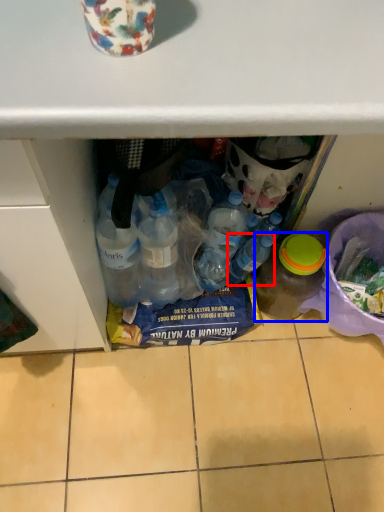
Question: Which of the following is the farthest to the observer, bottle (highlighted by a red box) or bottle (highlighted by a blue box)?

Choices:
 (A) bottle
 (B) bottle

Answer: (A)